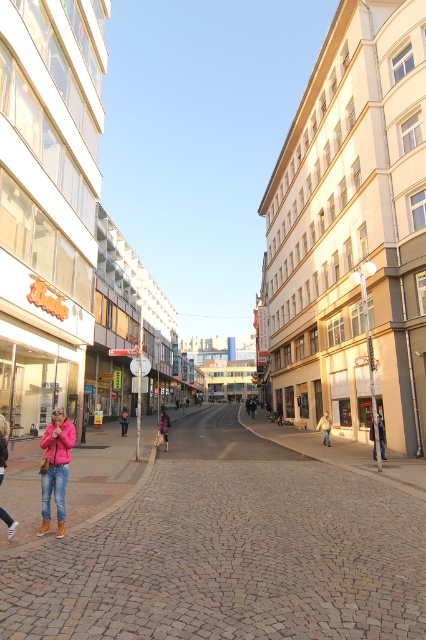
You are a pedestrian walking down the street and see the dark gray fabric jacket at right and the dark blue jeans at center. Which clothing item is located more to the right side of the street?

The dark gray fabric jacket at right is positioned on the right side of the dark blue jeans at center, so the dark gray fabric jacket at right is more to the right side of the street.

You are a delivery person standing at the center of the street. You need to pick up a package from the dark gray fabric jacket at right. Which direction should you walk to reach it?

The dark gray fabric jacket at right is located at point (382, 436), so you should walk towards the right side of the street to reach it.